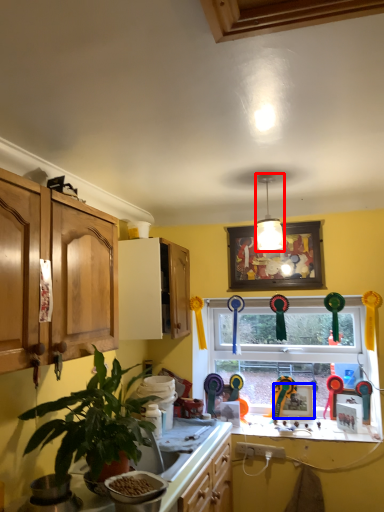
Question: Which of the following is the closest to the observer, light fixture (highlighted by a red box) or picture frame (highlighted by a blue box)?

Choices:
 (A) light fixture
 (B) picture frame

Answer: (A)